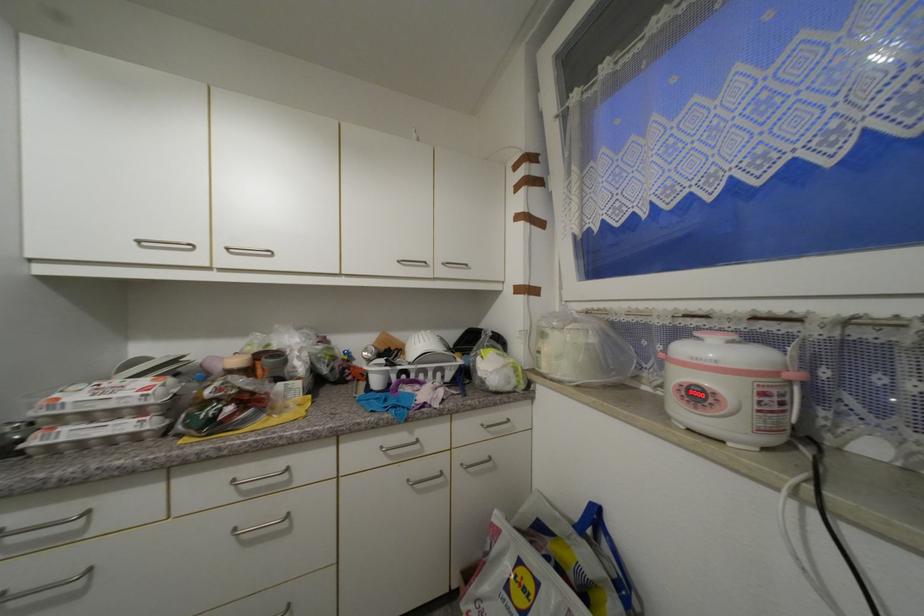
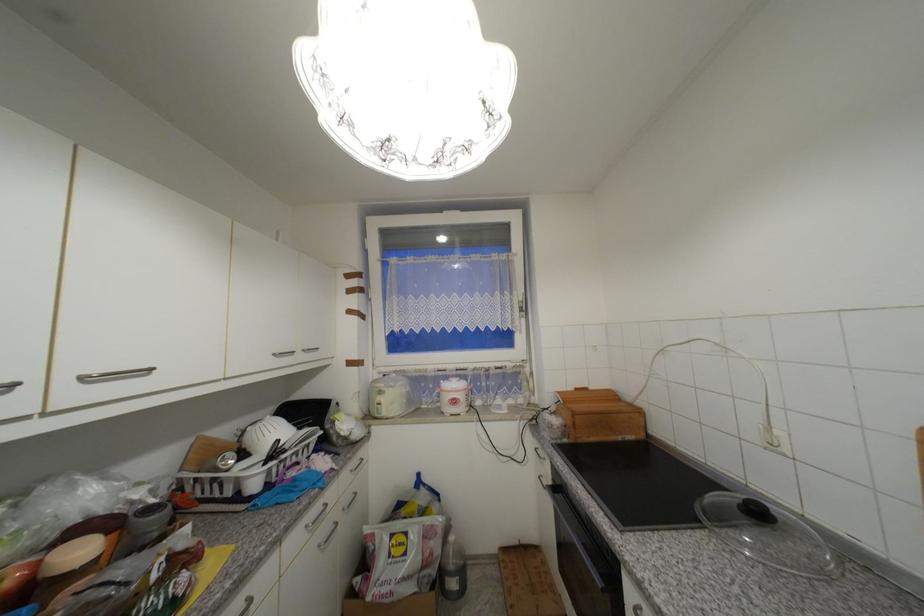
Find the pixel in the second image that matches the point at 431,373 in the first image.

(301, 454)